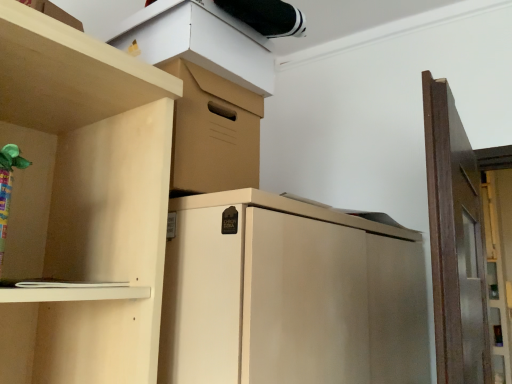
Question: Considering the relative positions of matte cardboard box at upper center and brown wooden door at right in the image provided, is matte cardboard box at upper center to the left of brown wooden door at right from the viewer's perspective?

Choices:
 (A) yes
 (B) no

Answer: (A)

Question: Considering the relative positions of matte cardboard box at upper center and brown wooden door at right in the image provided, is matte cardboard box at upper center behind brown wooden door at right?

Choices:
 (A) no
 (B) yes

Answer: (B)

Question: Considering the relative sizes of matte cardboard box at upper center and brown wooden door at right in the image provided, is matte cardboard box at upper center bigger than brown wooden door at right?

Choices:
 (A) yes
 (B) no

Answer: (B)

Question: Can we say matte cardboard box at upper center lies outside brown wooden door at right?

Choices:
 (A) no
 (B) yes

Answer: (B)

Question: Considering the relative sizes of matte cardboard box at upper center and brown wooden door at right in the image provided, is matte cardboard box at upper center smaller than brown wooden door at right?

Choices:
 (A) no
 (B) yes

Answer: (B)

Question: Does matte cardboard box at upper center lie in front of brown wooden door at right?

Choices:
 (A) no
 (B) yes

Answer: (A)

Question: Would you consider brown wooden door at right to be distant from matte cardboard box at upper center?

Choices:
 (A) yes
 (B) no

Answer: (B)

Question: Considering the relative sizes of brown wooden door at right and matte cardboard box at upper center in the image provided, is brown wooden door at right smaller than matte cardboard box at upper center?

Choices:
 (A) yes
 (B) no

Answer: (B)

Question: Is matte cardboard box at upper center at the back of brown wooden door at right?

Choices:
 (A) yes
 (B) no

Answer: (B)

Question: From the image's perspective, does brown wooden door at right appear higher than matte cardboard box at upper center?

Choices:
 (A) no
 (B) yes

Answer: (A)

Question: Is brown wooden door at right at the right side of matte cardboard box at upper center?

Choices:
 (A) no
 (B) yes

Answer: (B)

Question: From a real-world perspective, is brown wooden door at right positioned over matte cardboard box at upper center based on gravity?

Choices:
 (A) yes
 (B) no

Answer: (B)

Question: From their relative heights in the image, would you say brown wooden door at right is taller or shorter than matte cardboard box at upper center?

Choices:
 (A) short
 (B) tall

Answer: (B)